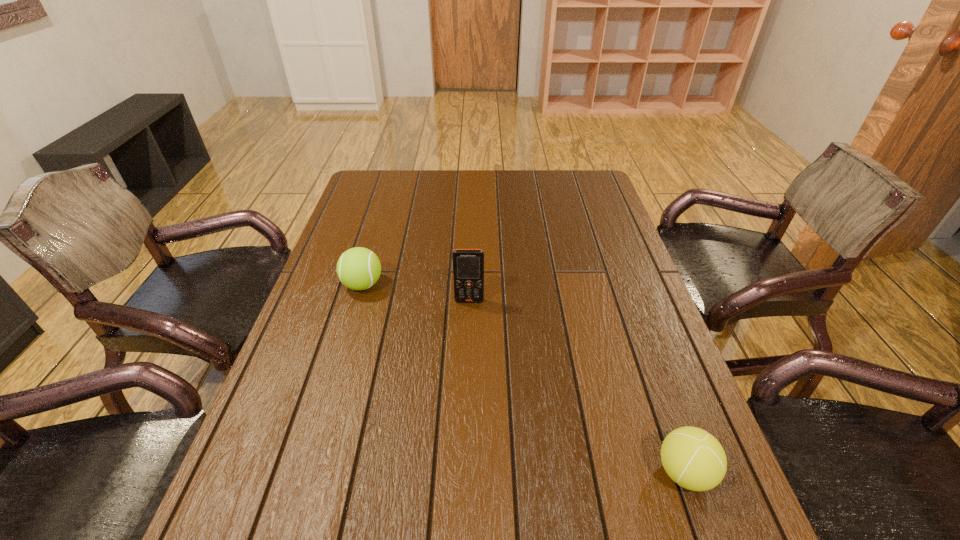
Locate an element on the screen. empty space between the tallest object and the left tennis ball is located at coordinates (416, 293).

Image resolution: width=960 pixels, height=540 pixels. Find the location of `free area in between the tallest object and the left tennis ball`. free area in between the tallest object and the left tennis ball is located at coordinates (416, 293).

Locate an element on the screen. vacant region between the nearer tennis ball and the farther tennis ball is located at coordinates (523, 379).

Identify the location of free space between the leftmost object and the right tennis ball. The width and height of the screenshot is (960, 540). (523, 379).

Locate an element on the screen. The height and width of the screenshot is (540, 960). object that ranks as the second closest to the cellular telephone is located at coordinates tap(694, 459).

The image size is (960, 540). In order to click on object that is the second closest one to the cellular telephone in this screenshot , I will do `click(694, 459)`.

Where is `vacant region that satisfies the following two spatial constraints: 1. on the screen of the second object from left to right; 2. on the left side of the nearer tennis ball`? vacant region that satisfies the following two spatial constraints: 1. on the screen of the second object from left to right; 2. on the left side of the nearer tennis ball is located at coordinates (465, 472).

The height and width of the screenshot is (540, 960). I want to click on blank area in the image that satisfies the following two spatial constraints: 1. on the screen of the nearer tennis ball; 2. on the left side of the second object from left to right, so click(465, 472).

Locate an element on the screen. free space that satisfies the following two spatial constraints: 1. on the screen of the rightmost object; 2. on the right side of the tallest object is located at coordinates (465, 472).

Locate an element on the screen. Image resolution: width=960 pixels, height=540 pixels. vacant space that satisfies the following two spatial constraints: 1. on the screen of the cellular telephone; 2. on the right side of the nearest object is located at coordinates (465, 472).